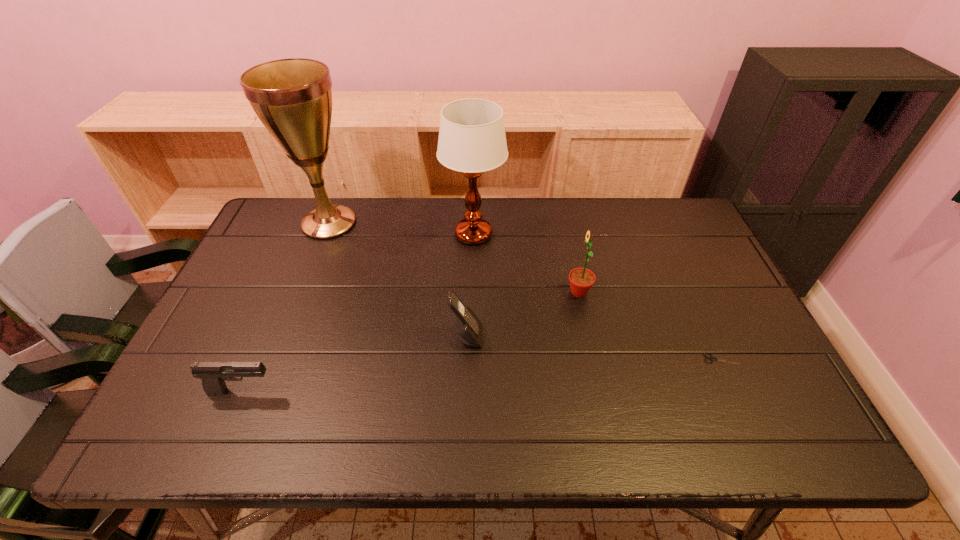
The image size is (960, 540). In order to click on vacant area located 0.100m on the right of the tallest object in this screenshot , I will do `click(393, 223)`.

The height and width of the screenshot is (540, 960). Find the location of `free location located 0.050m on the right of the fifth shortest object`. free location located 0.050m on the right of the fifth shortest object is located at coordinates (520, 234).

I want to click on free space located on the face of the sunflower, so click(x=538, y=292).

I want to click on vacant space located 0.330m on the face of the sunflower, so click(x=448, y=292).

What are the coordinates of `vacant region located 0.150m on the face of the sunflower` in the screenshot? It's located at (513, 292).

Identify the location of vacant region located 0.170m on the front-facing side of the cellular telephone. (549, 336).

Find the location of a particular element. The height and width of the screenshot is (540, 960). vacant space located aim along the barrel of the fifth tallest object is located at coordinates (437, 391).

At what (x,y) coordinates should I click in order to perform the action: click on vacant area located 0.160m on the front of the shears. Please return your answer as a coordinate pair (x, y). This screenshot has width=960, height=540. Looking at the image, I should click on (752, 427).

Locate an element on the screen. trophy cup that is at the far edge is located at coordinates (292, 97).

Where is `table lamp that is at the far edge`? The width and height of the screenshot is (960, 540). table lamp that is at the far edge is located at coordinates (472, 140).